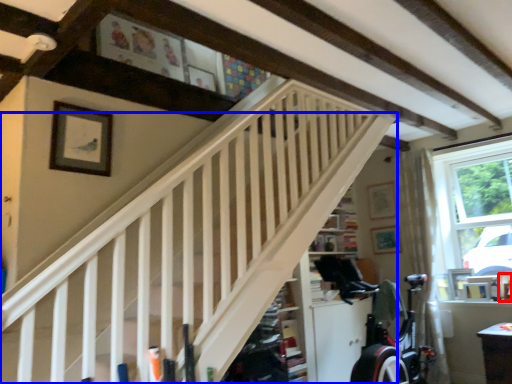
Question: Which object is further to the camera taking this photo, picture frame (highlighted by a red box) or stairs (highlighted by a blue box)?

Choices:
 (A) picture frame
 (B) stairs

Answer: (A)